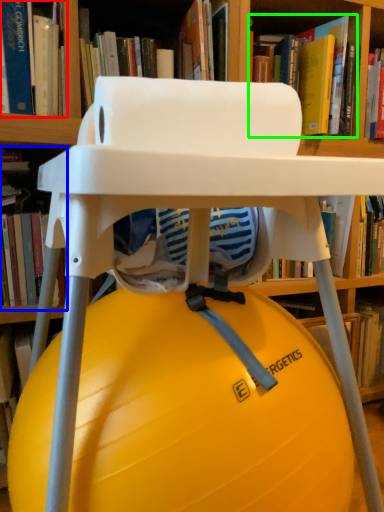
Question: Considering the real-world distances, which object is closest to book (highlighted by a red box)? book (highlighted by a blue box) or book (highlighted by a green box).

Choices:
 (A) book
 (B) book

Answer: (A)